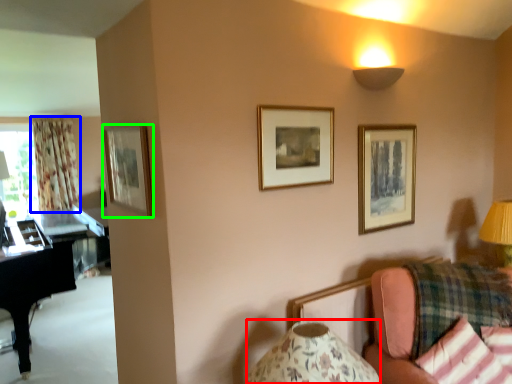
Question: Estimate the real-world distances between objects in this image. Which object is closer to table lamp (highlighted by a red box), curtain (highlighted by a blue box) or picture frame (highlighted by a green box)?

Choices:
 (A) curtain
 (B) picture frame

Answer: (B)